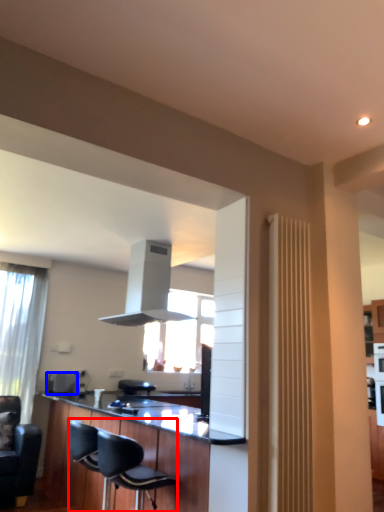
Question: Which point is closer to the camera, chair (highlighted by a red box) or appliance (highlighted by a blue box)?

Choices:
 (A) chair
 (B) appliance

Answer: (A)